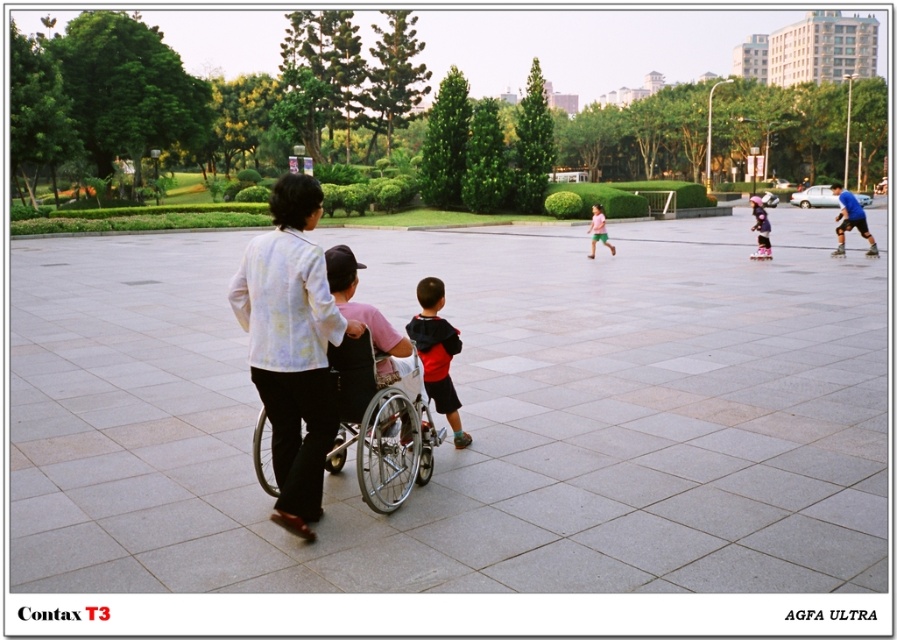
Question: Which object is the closest to the pink fabric shorts at center?

Choices:
 (A) black plastic roller skate at right
 (B) matte black roller skate at right
 (C) red hoodie at center
 (D) pink rubber roller skate at center

Answer: (D)

Question: Is pink rubber roller skate at center positioned behind black plastic roller skate at right?

Choices:
 (A) yes
 (B) no

Answer: (B)

Question: Is pink rubber roller skate at center below black plastic roller skate at right?

Choices:
 (A) no
 (B) yes

Answer: (B)

Question: Is silver metallic wheelchair at center to the right of pink rubber roller skate at center from the viewer's perspective?

Choices:
 (A) no
 (B) yes

Answer: (A)

Question: Which object is the farthest from the pink rubber roller skate at center?

Choices:
 (A) red hoodie at center
 (B) purple matte roller skates at center

Answer: (A)

Question: Which is nearer to the purple matte roller skates at center?

Choices:
 (A) matte black shirt at center
 (B) pink fabric shorts at center
 (C) pink rubber roller skate at center

Answer: (C)